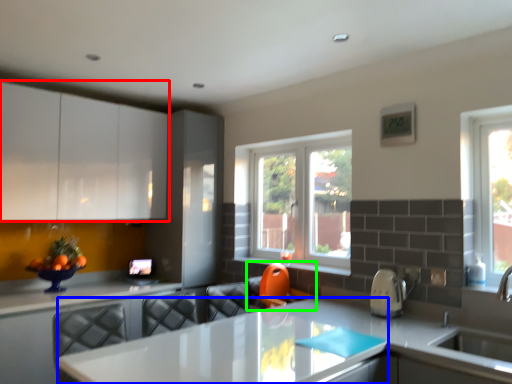
Question: Which is farther away from cabinetry (highlighted by a red box)? table (highlighted by a blue box) or swivel chair (highlighted by a green box)?

Choices:
 (A) table
 (B) swivel chair

Answer: (A)